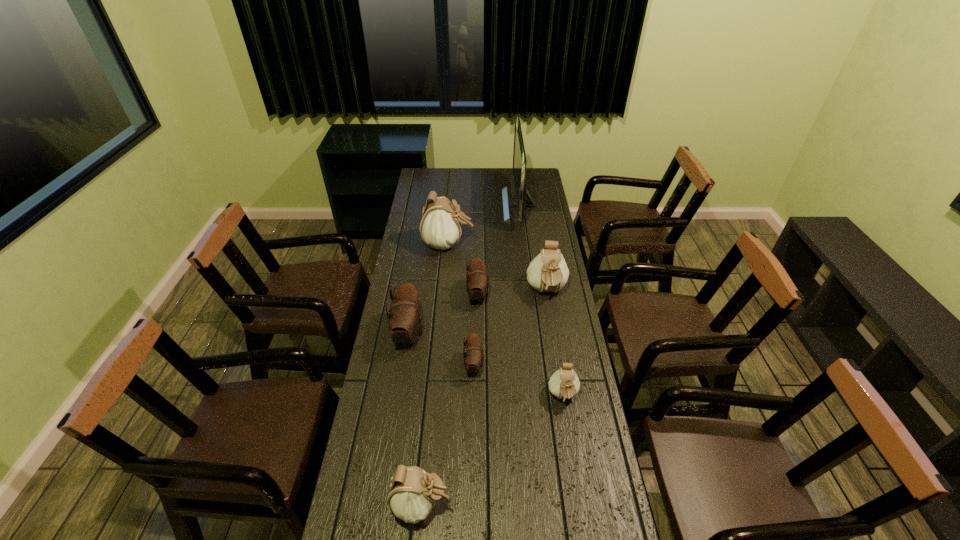
Find the location of a particular element. The height and width of the screenshot is (540, 960). the tallest object is located at coordinates (519, 157).

The image size is (960, 540). I want to click on the farthest pouch, so click(440, 228).

Find the location of a particular element. Image resolution: width=960 pixels, height=540 pixels. the biggest white pouch is located at coordinates (440, 228).

At what (x,y) coordinates should I click in order to perform the action: click on the second biggest white pouch. Please return your answer as a coordinate pair (x, y). The height and width of the screenshot is (540, 960). Looking at the image, I should click on (547, 272).

Locate an element on the screen. This screenshot has height=540, width=960. the leftmost brown pouch is located at coordinates (404, 318).

Identify the location of the second smallest white pouch. (412, 494).

You are a GUI agent. You are given a task and a screenshot of the screen. Output one action in this format:
    pyautogui.click(x=<x>, y=<y>)
    Task: Click on the nearest pouch
    
    Given the screenshot: What is the action you would take?
    pyautogui.click(x=412, y=494)

This screenshot has height=540, width=960. In order to click on the second biggest brown pouch in this screenshot , I will do `click(477, 281)`.

I want to click on the third farthest white pouch, so (x=564, y=384).

This screenshot has width=960, height=540. Find the location of `the smallest brown pouch`. the smallest brown pouch is located at coordinates (473, 355).